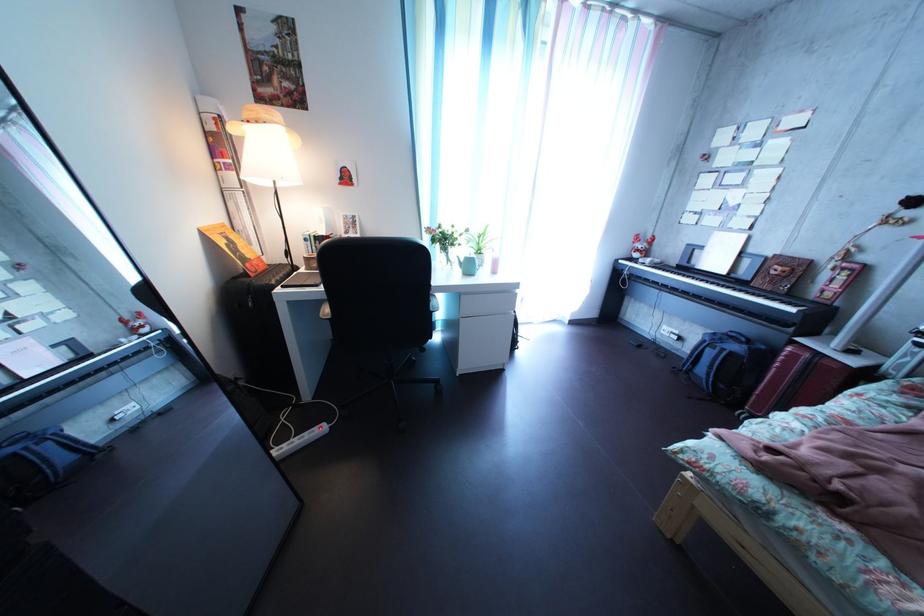
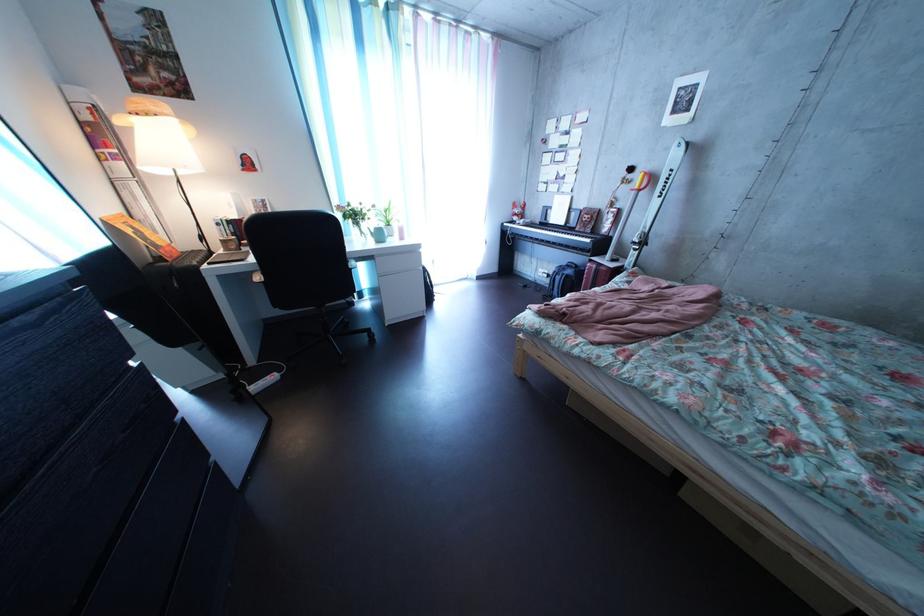
Question: The camera is either moving clockwise (left) or counter-clockwise (right) around the object. The first image is from the beginning of the video and the second image is from the end. Is the camera moving left or right when shooting the video?

Choices:
 (A) Left
 (B) Right

Answer: (A)